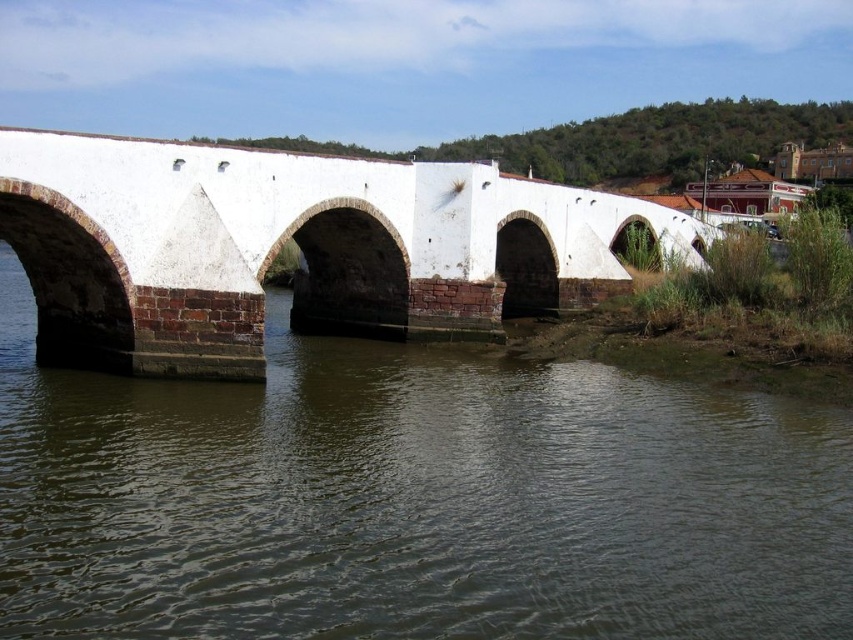
Question: Can you confirm if brown stone river at center is smaller than white brick bridge at center?

Choices:
 (A) no
 (B) yes

Answer: (B)

Question: Considering the relative positions of brown stone river at center and white brick bridge at center in the image provided, where is brown stone river at center located with respect to white brick bridge at center?

Choices:
 (A) below
 (B) above

Answer: (A)

Question: Which of the following is the farthest from the observer?

Choices:
 (A) brown stone river at center
 (B) white brick bridge at center

Answer: (B)

Question: Which of the following is the closest to the observer?

Choices:
 (A) (581, 484)
 (B) (660, 240)

Answer: (A)

Question: Which object is farther from the camera taking this photo?

Choices:
 (A) white brick bridge at center
 (B) brown stone river at center

Answer: (A)

Question: Does brown stone river at center have a lesser width compared to white brick bridge at center?

Choices:
 (A) yes
 (B) no

Answer: (A)